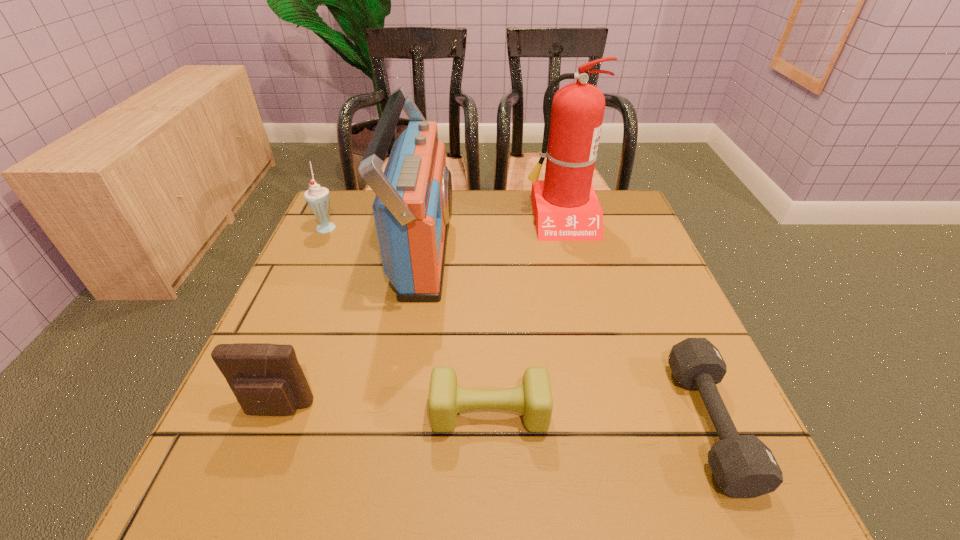
Find the location of a particular element. The width and height of the screenshot is (960, 540). free space located 0.130m with an open flap on the pouch is located at coordinates (238, 507).

Find the location of `vacant space located 0.310m on the back of the left dumbbell`. vacant space located 0.310m on the back of the left dumbbell is located at coordinates (487, 274).

The image size is (960, 540). Find the location of `free region located on the left of the rightmost object`. free region located on the left of the rightmost object is located at coordinates (566, 424).

You are a GUI agent. You are given a task and a screenshot of the screen. Output one action in this format:
    pyautogui.click(x=<x>, y=<y>)
    Task: Click on the fire extinguisher that is positioned at the far edge
    
    Given the screenshot: What is the action you would take?
    pyautogui.click(x=566, y=208)

This screenshot has width=960, height=540. In order to click on radio receiver at the far edge in this screenshot , I will do `click(413, 205)`.

Find the location of `milkshake at the far edge`. milkshake at the far edge is located at coordinates (318, 198).

This screenshot has width=960, height=540. Find the location of `object positioned at the near edge`. object positioned at the near edge is located at coordinates (743, 466).

This screenshot has width=960, height=540. In order to click on milkshake at the left edge in this screenshot , I will do `click(318, 198)`.

At what (x,y) coordinates should I click in order to perform the action: click on pouch present at the left edge. Please return your answer as a coordinate pair (x, y). Looking at the image, I should click on (266, 379).

I want to click on fire extinguisher that is positioned at the right edge, so click(x=566, y=208).